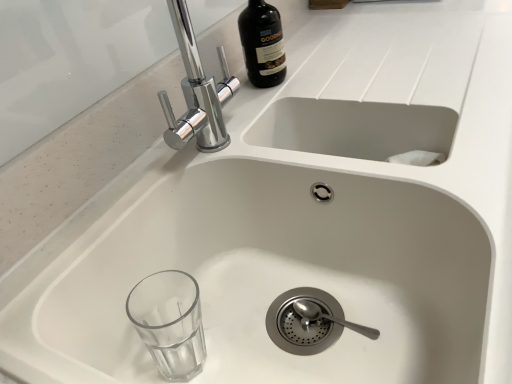
Question: Should I look upward or downward to see dark brown glass bottle at upper center?

Choices:
 (A) down
 (B) up

Answer: (B)